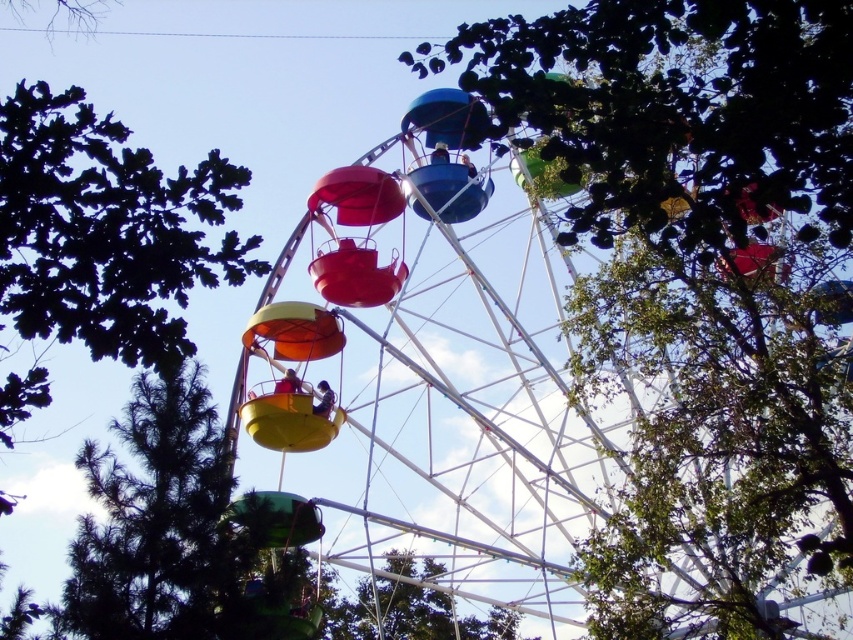
Which is behind, point (426, 333) or point (10, 298)?

The point (426, 333) is behind.

Find the location of a particular element. The height and width of the screenshot is (640, 853). metallic ferris wheel at center is located at coordinates pyautogui.click(x=439, y=380).

Which is behind, point (344, 266) or point (395, 604)?

The point (395, 604) is more distant.

Is point (619, 435) positioned in front of point (437, 616)?

No, (619, 435) is behind (437, 616).

Locate an element on the screen. The width and height of the screenshot is (853, 640). metallic ferris wheel at center is located at coordinates (439, 380).

Who is positioned more to the left, dark green leafy tree at lower left or green leafy tree at center?

Positioned to the left is dark green leafy tree at lower left.

Does dark green leafy tree at lower left have a greater height compared to green leafy tree at center?

Indeed, dark green leafy tree at lower left has a greater height compared to green leafy tree at center.

Does point (260, 240) lie in front of point (503, 628)?

Yes, it is.

At what (x,y) coordinates should I click in order to perform the action: click on dark green leafy tree at lower left. Please return your answer as a coordinate pair (x, y). Image resolution: width=853 pixels, height=640 pixels. Looking at the image, I should click on (106, 230).